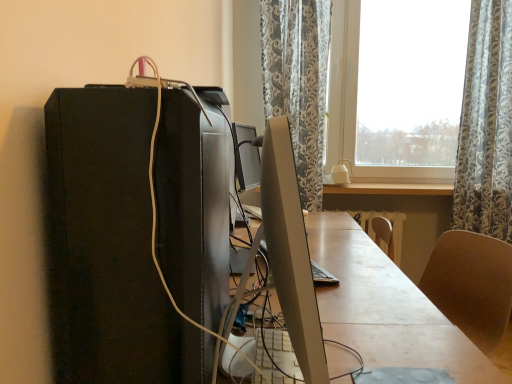
The height and width of the screenshot is (384, 512). I want to click on free space to the right of satin silver monitor at center, so click(x=386, y=333).